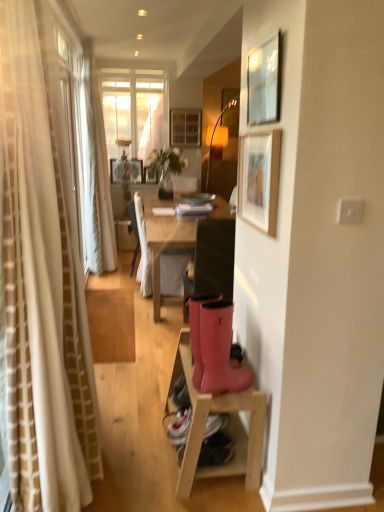
Question: Is there a large distance between metallic silver picture frame at upper right, acting as the 1th picture frame starting from the right, and wooden picture frame at center, which is the 3th picture frame from right to left?

Choices:
 (A) no
 (B) yes

Answer: (B)

Question: Is metallic silver picture frame at upper right, placed as the 1th picture frame when sorted from front to back, wider than wooden picture frame at center, marked as the second picture frame in a left-to-right arrangement?

Choices:
 (A) no
 (B) yes

Answer: (A)

Question: Does metallic silver picture frame at upper right, acting as the 1th picture frame starting from the right, lie in front of wooden picture frame at center, the 3th picture frame from the bottom?

Choices:
 (A) yes
 (B) no

Answer: (A)

Question: Does metallic silver picture frame at upper right, which is the third picture frame in top-to-bottom order, have a lesser height compared to wooden picture frame at center, which is the 3th picture frame from right to left?

Choices:
 (A) no
 (B) yes

Answer: (A)

Question: Is metallic silver picture frame at upper right, the 4th picture frame in the back-to-front sequence, bigger than wooden picture frame at center, the fourth picture frame positioned from the front?

Choices:
 (A) yes
 (B) no

Answer: (A)

Question: Visually, is matte black chair at center, which is the 2th chair in left-to-right order, positioned to the left or to the right of wooden stool at lower right?

Choices:
 (A) left
 (B) right

Answer: (B)

Question: From a real-world perspective, is matte black chair at center, which is the 1th chair from front to back, above or below wooden stool at lower right?

Choices:
 (A) below
 (B) above

Answer: (B)

Question: Considering the positions of matte black chair at center, which is the 1th chair from front to back, and wooden stool at lower right in the image, is matte black chair at center, which is the 1th chair from front to back, taller or shorter than wooden stool at lower right?

Choices:
 (A) short
 (B) tall

Answer: (B)

Question: Is matte black chair at center, which is the 1th chair from front to back, spatially inside wooden stool at lower right, or outside of it?

Choices:
 (A) inside
 (B) outside

Answer: (B)

Question: Looking at the image, does white fabric chair at center, positioned as the 1th chair in back-to-front order, seem bigger or smaller compared to metallic silver picture frame at upper right, acting as the 1th picture frame starting from the right?

Choices:
 (A) big
 (B) small

Answer: (A)

Question: Is point (160, 266) positioned closer to the camera than point (269, 89)?

Choices:
 (A) farther
 (B) closer

Answer: (A)

Question: Would you say white fabric chair at center, positioned as the first chair in left-to-right order, is to the left or to the right of metallic silver picture frame at upper right, which is the third picture frame in top-to-bottom order, in the picture?

Choices:
 (A) right
 (B) left

Answer: (B)

Question: Which is correct: white fabric chair at center, positioned as the first chair in left-to-right order, is inside metallic silver picture frame at upper right, the 4th picture frame from the left, or outside of it?

Choices:
 (A) outside
 (B) inside

Answer: (A)

Question: From the image's perspective, relative to wooden picture frame at center, the 3th picture frame from the bottom, is white fabric chair at center, which appears as the 2th chair when viewed from the right, above or below?

Choices:
 (A) above
 (B) below

Answer: (B)

Question: Considering their positions, is white fabric chair at center, positioned as the 1th chair in back-to-front order, located in front of or behind wooden picture frame at center, marked as the second picture frame in a left-to-right arrangement?

Choices:
 (A) front
 (B) behind

Answer: (A)